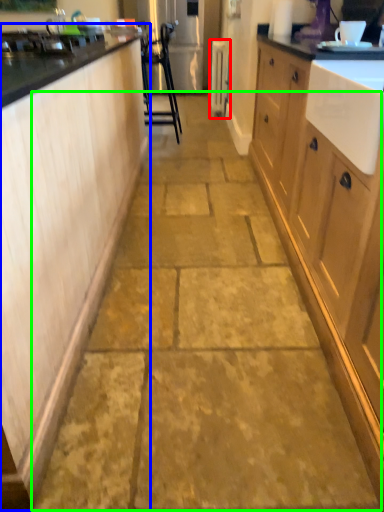
Question: Estimate the real-world distances between objects in this image. Which object is closer to appliance (highlighted by a red box), cabinetry (highlighted by a blue box) or path (highlighted by a green box)?

Choices:
 (A) cabinetry
 (B) path

Answer: (B)